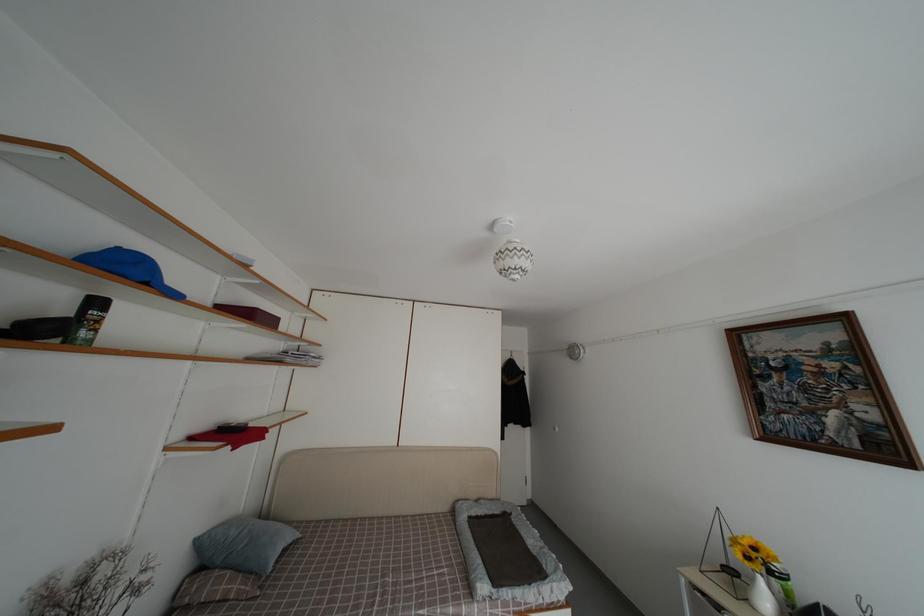
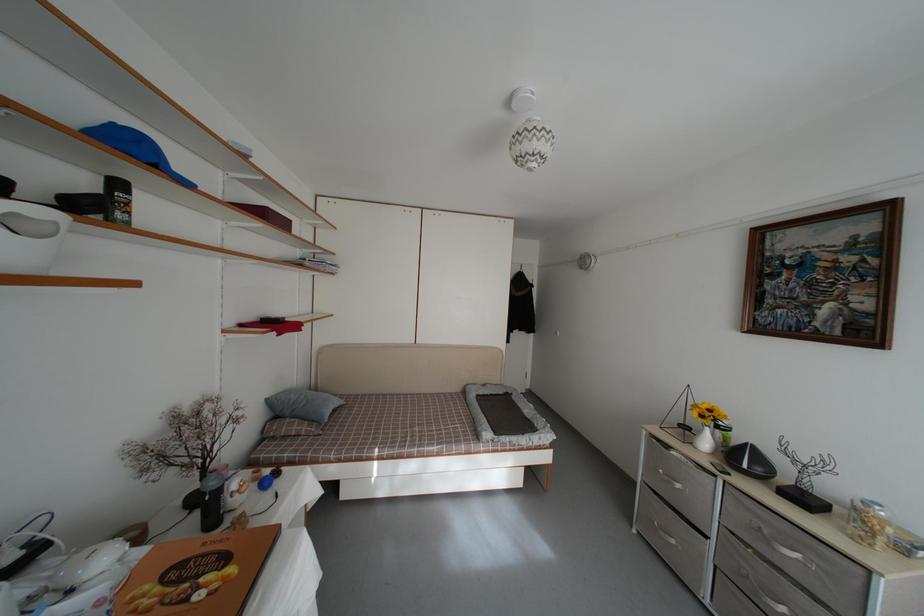
Locate, in the second image, the point that corresponds to (202,546) in the first image.

(274, 407)